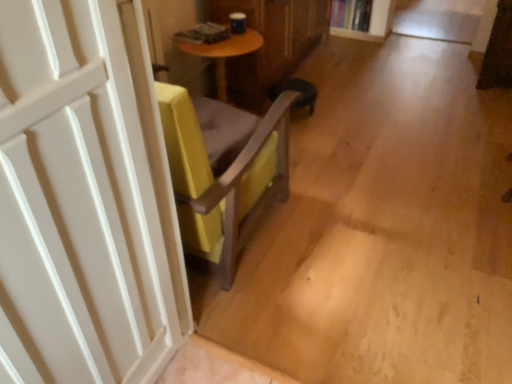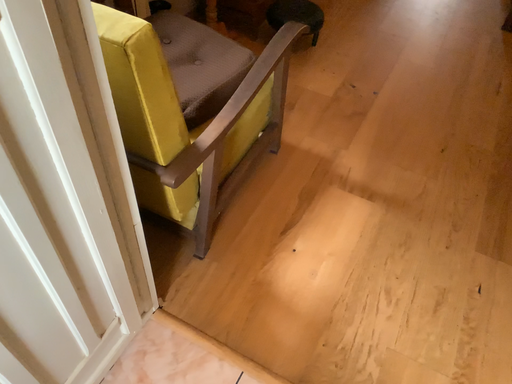
Question: Which way did the camera rotate in the video?

Choices:
 (A) rotated downward
 (B) rotated upward

Answer: (A)